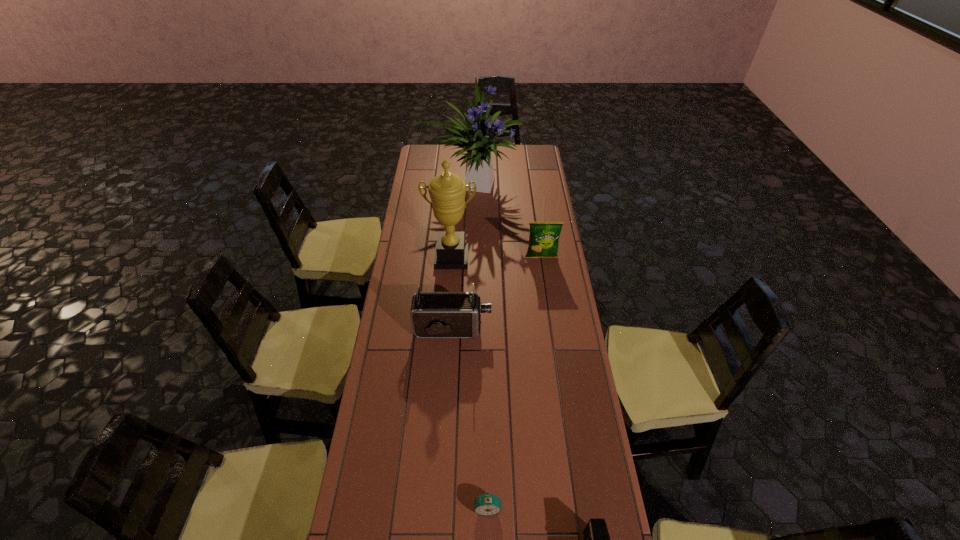
The width and height of the screenshot is (960, 540). Find the location of `free space at the left edge`. free space at the left edge is located at coordinates (412, 181).

What are the coordinates of `free space at the right edge of the desktop` in the screenshot? It's located at (530, 211).

In the image, there is a desktop. Identify the location of vacant space at the far left corner. The image size is (960, 540). coord(433,155).

In the image, there is a desktop. In order to click on free region at the far right corner in this screenshot , I will do `click(539, 152)`.

Find the location of a particular element. free spot between the shortest object and the farther camcorder is located at coordinates (470, 418).

Where is `vacant area between the trophy cup and the farthest object`? The height and width of the screenshot is (540, 960). vacant area between the trophy cup and the farthest object is located at coordinates (464, 221).

In order to click on unoccupied area between the shortest object and the farthest object in this screenshot , I will do `click(482, 346)`.

Identify the location of vacant area that lies between the flower arrangement and the shortest object. (482, 346).

This screenshot has height=540, width=960. I want to click on free spot between the second nearest object and the trophy cup, so click(469, 383).

This screenshot has width=960, height=540. Identify the location of object identified as the closest to the farthest object. (447, 191).